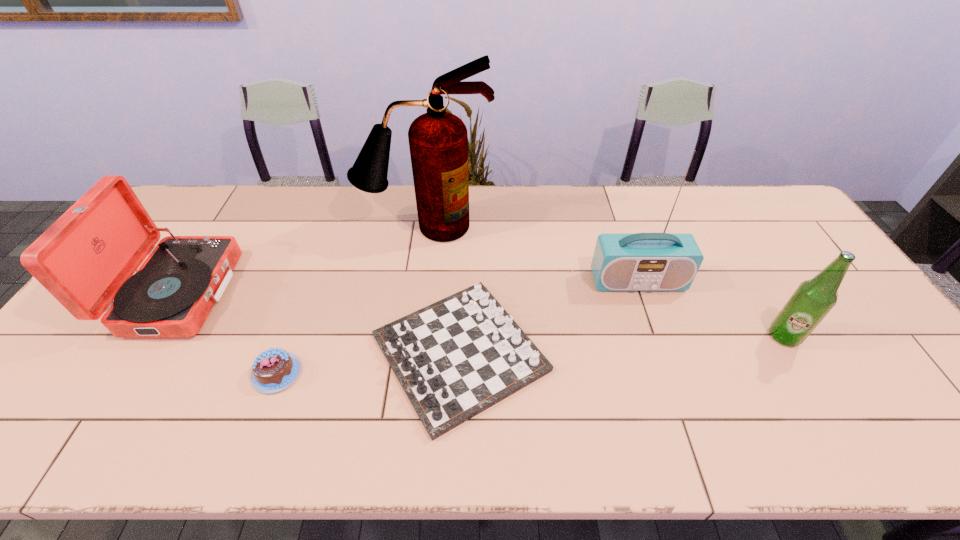
You are a GUI agent. You are given a task and a screenshot of the screen. Output one action in this format:
    pyautogui.click(x=<x>, y=<y>)
    Task: Click on the object that is the fourth closest to the rightmost object
    This screenshot has width=960, height=540.
    Given the screenshot: What is the action you would take?
    pyautogui.click(x=274, y=370)

This screenshot has height=540, width=960. Find the location of `vacant position in the image that satisfies the following two spatial constraints: 1. at the nozzle of the tallest object; 2. on the right side of the chessboard`. vacant position in the image that satisfies the following two spatial constraints: 1. at the nozzle of the tallest object; 2. on the right side of the chessboard is located at coordinates (409, 353).

The height and width of the screenshot is (540, 960). What are the coordinates of `vacant area that satisfies the following two spatial constraints: 1. on the front-facing side of the phonograph_record; 2. on the back side of the chocolate cake` in the screenshot? It's located at (130, 373).

The height and width of the screenshot is (540, 960). In order to click on blank space that satisfies the following two spatial constraints: 1. on the front panel of the radio receiver; 2. on the front-facing side of the phonograph_record in this screenshot , I will do `click(641, 293)`.

This screenshot has height=540, width=960. What are the coordinates of `free location that satisfies the following two spatial constraints: 1. on the front-facing side of the phonograph_record; 2. on the left side of the chessboard` in the screenshot? It's located at (142, 353).